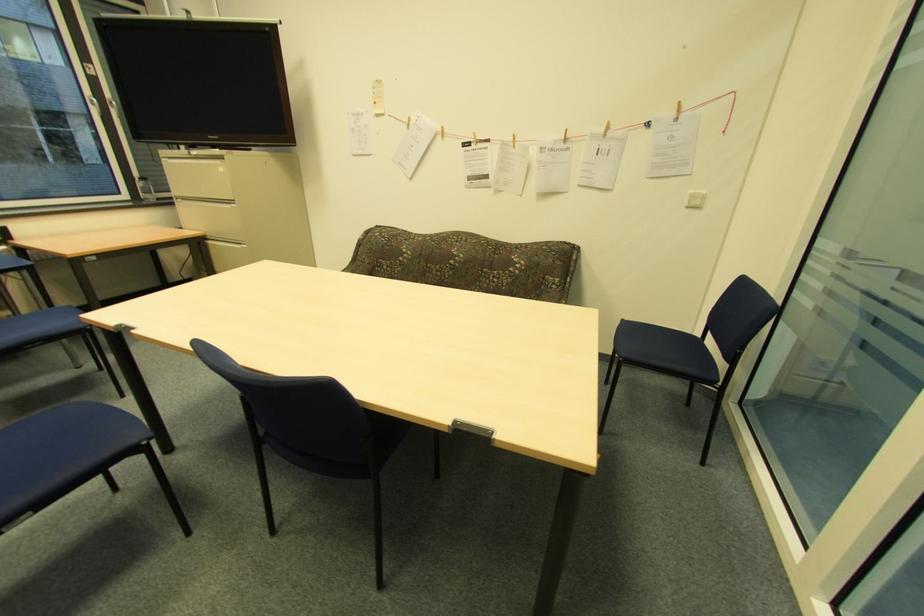
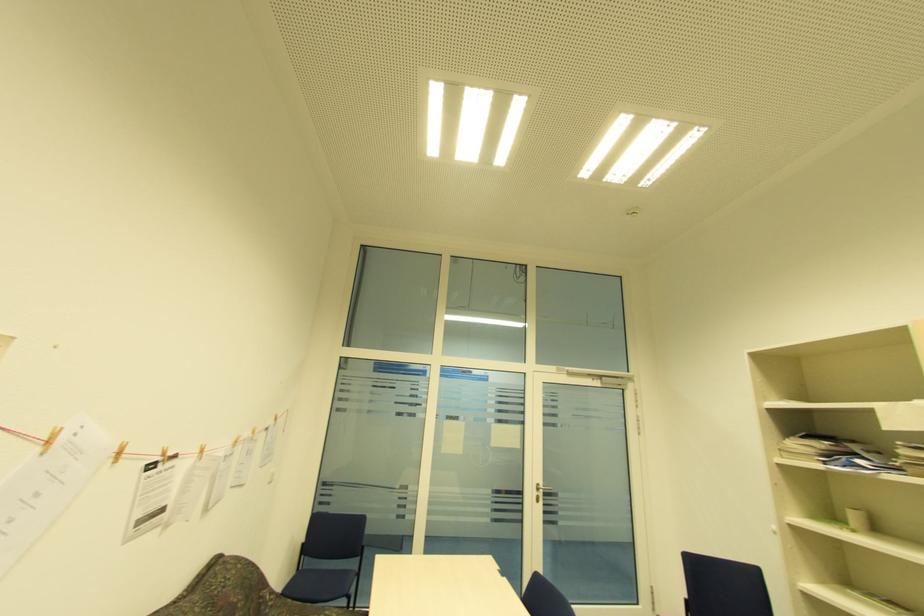
Find the pixel in the second image that matches the point at 475,137 in the first image.

(163, 454)